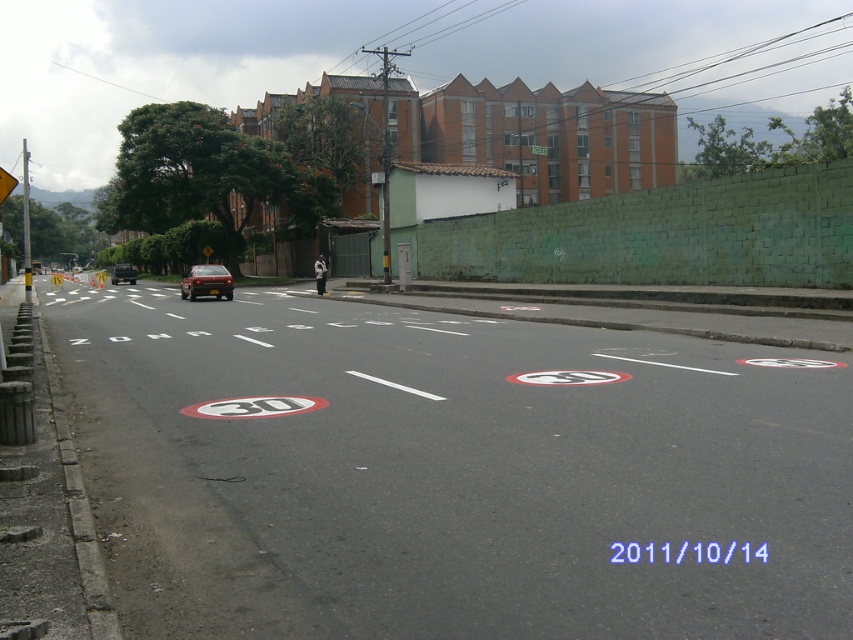
Question: Is the position of shiny metallic car at center more distant than that of green plastic traffic sign at upper center?

Choices:
 (A) no
 (B) yes

Answer: (A)

Question: Is shiny metallic car at center above green plastic traffic sign at upper center?

Choices:
 (A) yes
 (B) no

Answer: (B)

Question: Which point is farther to the camera?

Choices:
 (A) (120, 280)
 (B) (209, 269)
 (C) (546, 147)

Answer: (C)

Question: Which is nearer to the shiny metallic car at center?

Choices:
 (A) shiny black sedan at center
 (B) green plastic traffic sign at upper center

Answer: (A)

Question: Can you confirm if shiny metallic car at center is wider than green plastic traffic sign at upper center?

Choices:
 (A) yes
 (B) no

Answer: (A)

Question: Which of these objects is positioned closest to the green plastic traffic sign at upper center?

Choices:
 (A) shiny metallic car at center
 (B) shiny black sedan at center

Answer: (A)